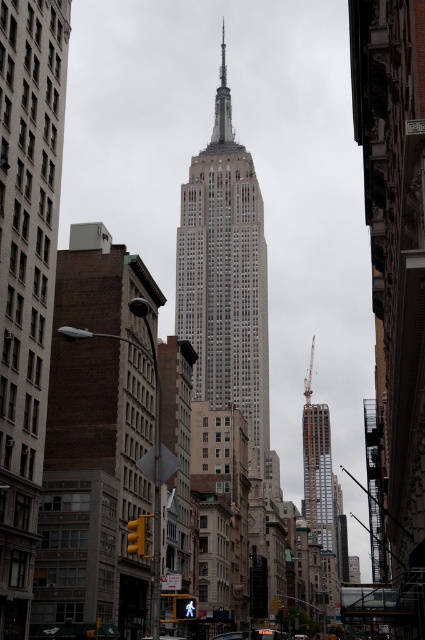
Question: Which point is farther from the camera taking this photo?

Choices:
 (A) (226, 77)
 (B) (198, 400)

Answer: (A)

Question: Can you confirm if white glass building at center is thinner than metallic silver spire at center?

Choices:
 (A) yes
 (B) no

Answer: (B)

Question: Considering the relative positions of silver metallic spire at center and metallic silver spire at center in the image provided, where is silver metallic spire at center located with respect to metallic silver spire at center?

Choices:
 (A) above
 (B) below

Answer: (A)

Question: Can you confirm if white glass building at center is positioned to the right of silver metallic spire at center?

Choices:
 (A) no
 (B) yes

Answer: (A)

Question: Which object appears closest to the camera in this image?

Choices:
 (A) metallic silver spire at center
 (B) metallic silver car at center

Answer: (B)

Question: Based on their relative distances, which object is farther from the metallic silver spire at center?

Choices:
 (A) silver metallic spire at center
 (B) white glass building at center

Answer: (B)